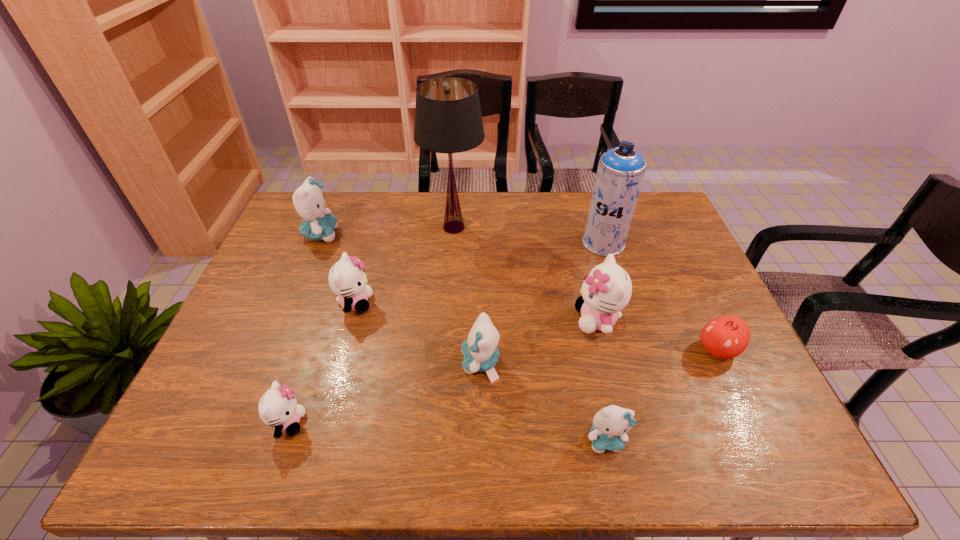
Find the location of a particular element. object that is at the right edge is located at coordinates (726, 337).

The height and width of the screenshot is (540, 960). In order to click on object that is at the far left corner in this screenshot , I will do `click(309, 202)`.

You are a GUI agent. You are given a task and a screenshot of the screen. Output one action in this format:
    pyautogui.click(x=<x>, y=<y>)
    Task: Click on the vacant space at the far edge of the desktop
    This screenshot has width=960, height=540.
    Given the screenshot: What is the action you would take?
    pyautogui.click(x=495, y=223)

Find the location of a particular element. vacant region at the near edge of the desktop is located at coordinates (524, 451).

The width and height of the screenshot is (960, 540). In order to click on free spot at the left edge of the desktop in this screenshot , I will do `click(294, 280)`.

This screenshot has height=540, width=960. In the image, there is a desktop. In order to click on vacant space at the right edge in this screenshot , I will do `click(703, 279)`.

The height and width of the screenshot is (540, 960). Find the location of `vacant space at the far left corner of the desktop`. vacant space at the far left corner of the desktop is located at coordinates (288, 232).

What are the coordinates of `vacant space at the near left corner of the desktop` in the screenshot? It's located at (184, 437).

Locate an element on the screen. empty space between the tallest object and the farthest blue kitten is located at coordinates (388, 231).

The image size is (960, 540). Find the location of `vacant region between the biggest white kitten and the rightmost blue kitten`. vacant region between the biggest white kitten and the rightmost blue kitten is located at coordinates (602, 380).